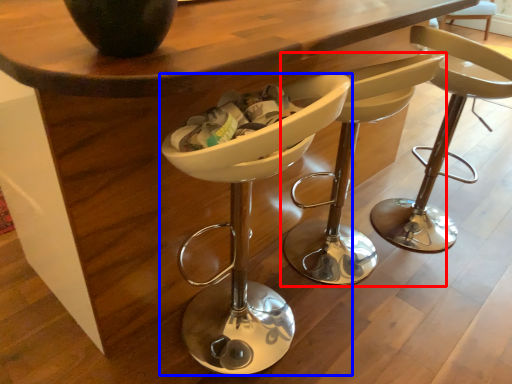
Question: Which of the following is the farthest to the observer, chair (highlighted by a red box) or chair (highlighted by a blue box)?

Choices:
 (A) chair
 (B) chair

Answer: (A)